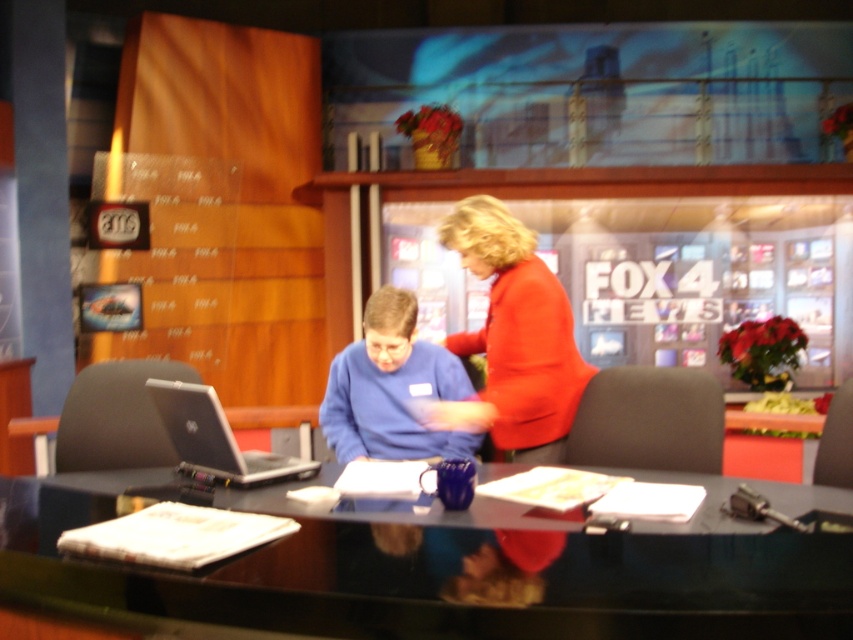
Question: Does shiny black desk at center come behind silver metallic laptop at center?

Choices:
 (A) no
 (B) yes

Answer: (A)

Question: Among these points, which one is nearest to the camera?

Choices:
 (A) (321, 404)
 (B) (140, 596)

Answer: (B)

Question: Can you confirm if matte red sweater at center is smaller than silver metallic laptop at center?

Choices:
 (A) no
 (B) yes

Answer: (A)

Question: Which object is positioned closest to the shiny black desk at center?

Choices:
 (A) blue matte sweater at center
 (B) matte red sweater at center
 (C) silver metallic laptop at center

Answer: (C)

Question: Which object is the farthest from the matte red sweater at center?

Choices:
 (A) silver metallic laptop at center
 (B) blue matte sweater at center

Answer: (A)

Question: Is shiny black desk at center behind silver metallic laptop at center?

Choices:
 (A) no
 (B) yes

Answer: (A)